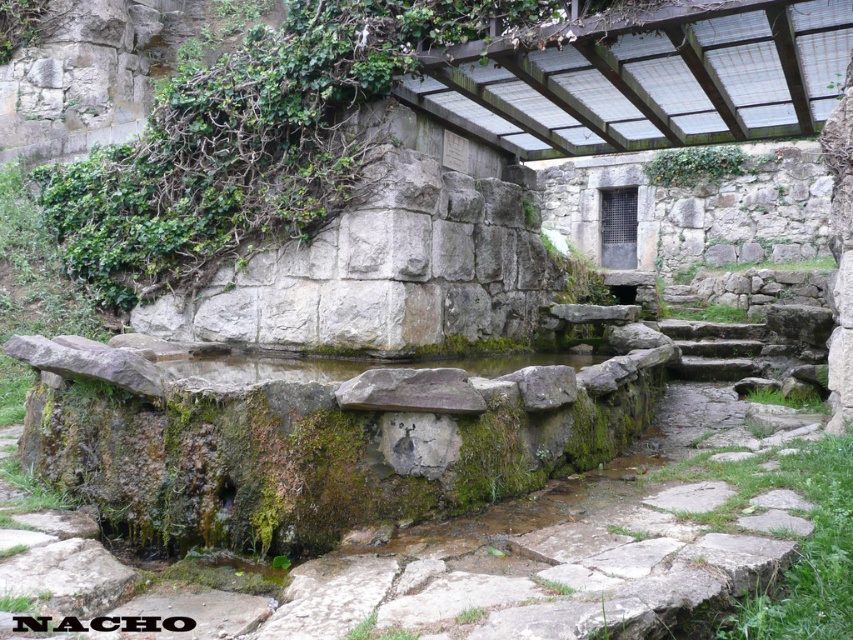
Looking at this image, you are a painter standing at the base of the old stone structure. You want to paint the gray rough stone wall at upper left and the green mossy vines at upper center. Which object will require you to tilt your head upwards more to view it properly?

The gray rough stone wall at upper left is much taller than the green mossy vines at upper center, so you will need to tilt your head upwards more to view the gray rough stone wall at upper left properly.

You are an architect designing a garden and want to place a statue between the gray rough stone wall at upper left and the green mossy vines at upper center. Which side of the statue should face the wider object to ensure proper alignment?

The gray rough stone wall at upper left is wider than the green mossy vines at upper center. Therefore, the statue should face towards the gray rough stone wall at upper left to align with its wider structure.